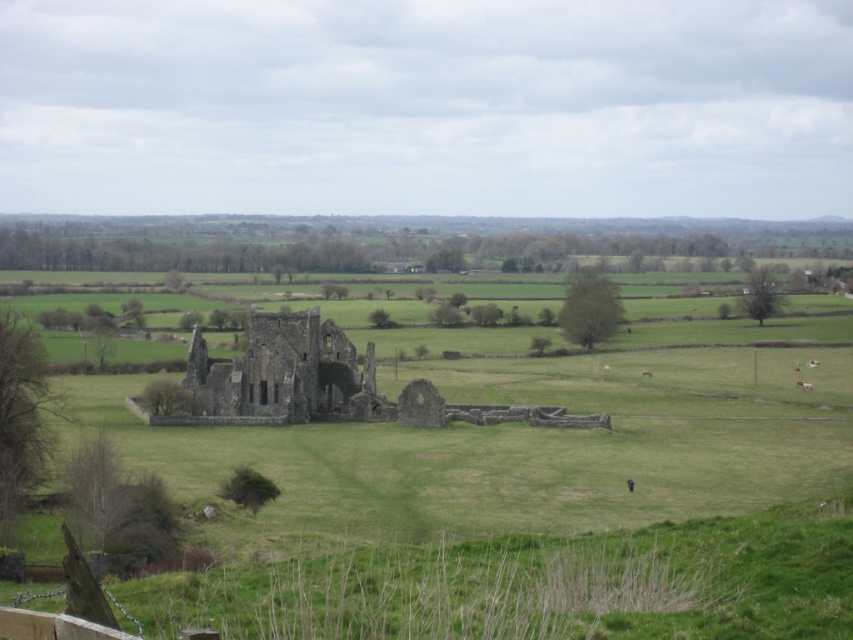
Question: Based on their relative distances, which object is farther from the green grassy field at center?

Choices:
 (A) brown stone ruins at center
 (B) brown furry cow at lower right
 (C) brown fuzzy sheep at lower right

Answer: (C)

Question: Is green grassy field at center above brown fuzzy sheep at lower right?

Choices:
 (A) yes
 (B) no

Answer: (B)

Question: Can you confirm if brown furry cow at lower right is smaller than brown fuzzy sheep at lower right?

Choices:
 (A) no
 (B) yes

Answer: (B)

Question: Which point is closer to the camera?

Choices:
 (A) (802, 381)
 (B) (817, 364)
 (C) (199, 397)

Answer: (C)

Question: Does green grassy field at center appear on the left side of brown furry cow at lower right?

Choices:
 (A) yes
 (B) no

Answer: (A)

Question: Among these objects, which one is nearest to the camera?

Choices:
 (A) brown stone ruins at center
 (B) brown fuzzy sheep at lower right

Answer: (A)